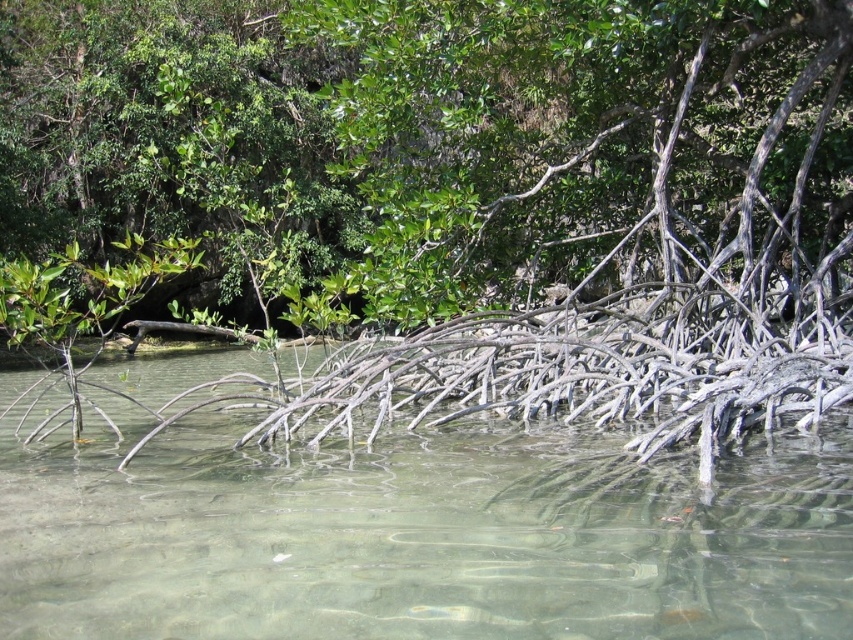
Can you confirm if green leafy tree at upper center is wider than clear water at center?

Yes, green leafy tree at upper center is wider than clear water at center.

Does green leafy tree at upper center have a greater height compared to clear water at center?

Yes, green leafy tree at upper center is taller than clear water at center.

The image size is (853, 640). Describe the element at coordinates (399, 125) in the screenshot. I see `green leafy tree at upper center` at that location.

At what (x,y) coordinates should I click in order to perform the action: click on green leafy tree at upper center. Please return your answer as a coordinate pair (x, y). The height and width of the screenshot is (640, 853). Looking at the image, I should click on (399, 125).